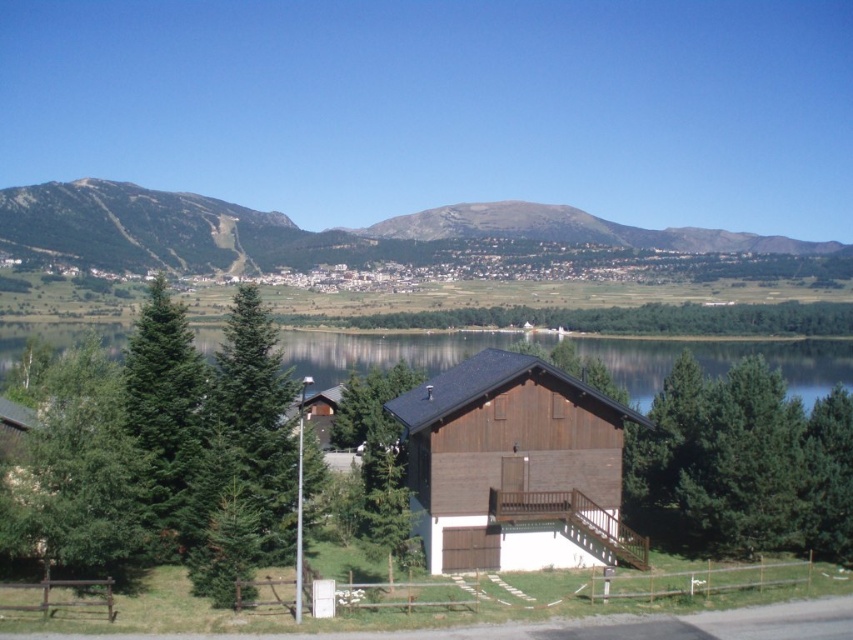
Is brown wooden cabin at center below green textured pine tree at center?

Yes.

In order to click on brown wooden cabin at center in this screenshot , I will do `click(515, 467)`.

Is point (616, 241) positioned behind point (556, 520)?

Yes, point (616, 241) is behind point (556, 520).

Where is `rugged brown mountain at upper left`? The width and height of the screenshot is (853, 640). rugged brown mountain at upper left is located at coordinates (347, 234).

Does brown wooden cabin at center have a larger size compared to transparent water at center?

Actually, brown wooden cabin at center might be smaller than transparent water at center.

Between brown wooden cabin at center and transparent water at center, which one appears on the right side from the viewer's perspective?

Positioned to the right is brown wooden cabin at center.

This screenshot has width=853, height=640. What are the coordinates of `brown wooden cabin at center` in the screenshot? It's located at click(515, 467).

Image resolution: width=853 pixels, height=640 pixels. Identify the location of brown wooden cabin at center. [515, 467].